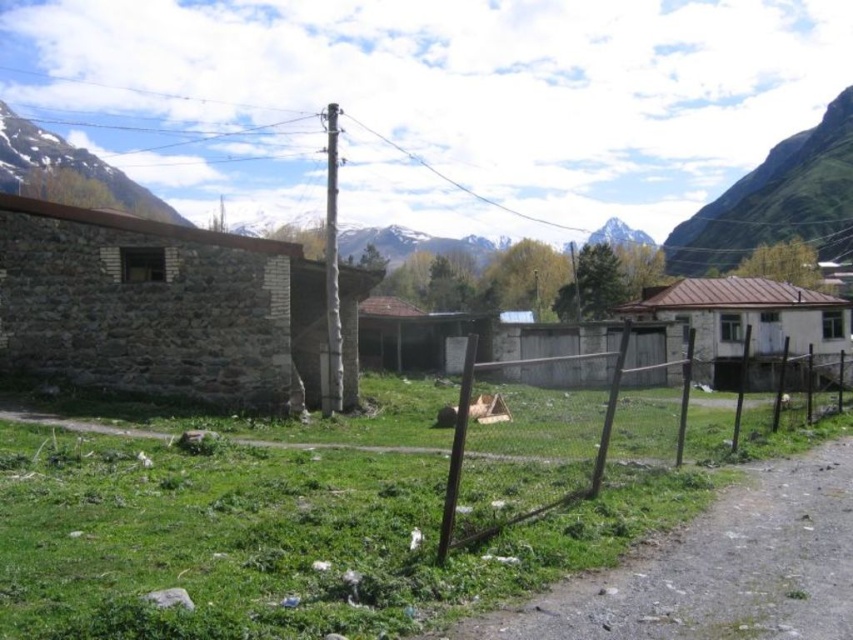
You are a hiker trying to reach the top of the green grassy mountain at upper right. You see the metallic wire fence at center blocking your path. Can you climb over the fence to continue towards the mountain?

The green grassy mountain at upper right is much taller than the metallic wire fence at center, so yes, you can climb over the fence to continue towards the mountain since it is shorter than the mountain.

You are standing at the center of the image and want to look towards the green grassy mountain at upper right. In which direction should you turn your head?

The green grassy mountain at upper right is located at point (776, 200), so you should turn your head to the upper right direction to look towards it.